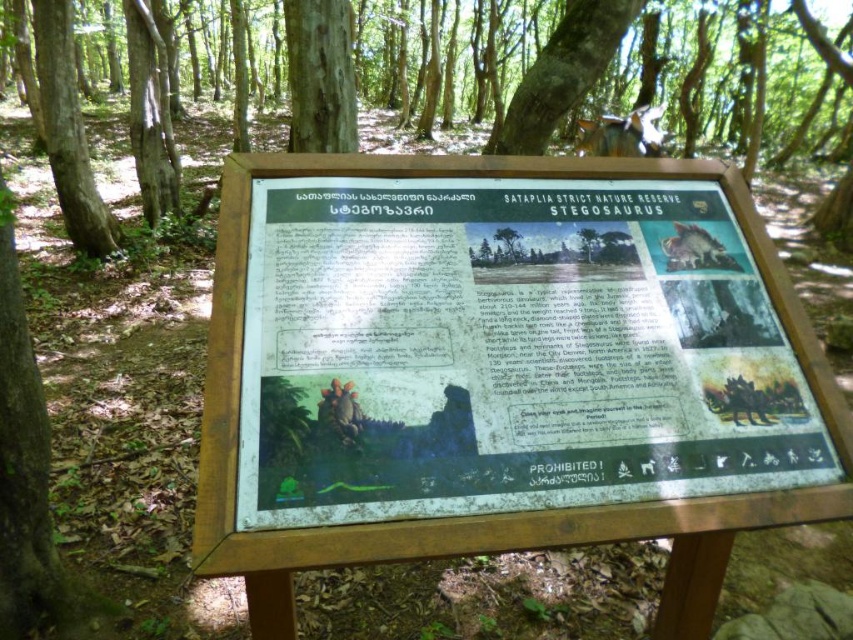
Question: Is brown wood sign at center further to the viewer compared to shiny metallic dinosaur at center?

Choices:
 (A) no
 (B) yes

Answer: (B)

Question: Considering the real-world distances, which object is farthest from the brown wood sign at center?

Choices:
 (A) smooth bark tree at upper center
 (B) smooth brown bark at upper center
 (C) shiny metallic bird at upper center

Answer: (B)

Question: Is shiny metallic bird at upper center wider than shiny metallic dinosaur at center?

Choices:
 (A) yes
 (B) no

Answer: (A)

Question: Which point is closer to the camera?

Choices:
 (A) shiny metallic dinosaur at center
 (B) smooth bark tree at upper center
 (C) brown wood sign at center

Answer: (A)

Question: Does smooth bark tree at upper center appear on the left side of shiny metallic bird at upper center?

Choices:
 (A) yes
 (B) no

Answer: (A)

Question: Among these points, which one is farthest from the camera?

Choices:
 (A) (329, 22)
 (B) (625, 122)

Answer: (B)